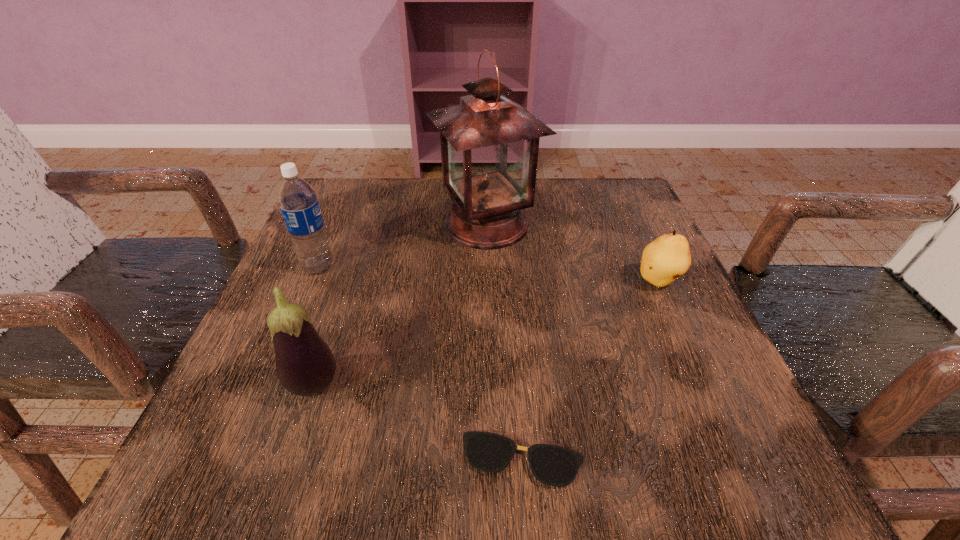
Image resolution: width=960 pixels, height=540 pixels. In order to click on the tallest object in this screenshot , I will do `click(489, 144)`.

Find the location of `water bottle`. water bottle is located at coordinates (298, 202).

Locate an element on the screen. This screenshot has width=960, height=540. eggplant is located at coordinates (305, 365).

At what (x,y) coordinates should I click in order to perform the action: click on the second nearest object. Please return your answer as a coordinate pair (x, y). Image resolution: width=960 pixels, height=540 pixels. Looking at the image, I should click on (305, 365).

Locate an element on the screen. The height and width of the screenshot is (540, 960). pear is located at coordinates (664, 260).

At what (x,y) coordinates should I click in order to perform the action: click on the second shortest object. Please return your answer as a coordinate pair (x, y). This screenshot has height=540, width=960. Looking at the image, I should click on (x=664, y=260).

I want to click on spectacles, so click(552, 465).

At what (x,y) coordinates should I click in order to perform the action: click on the shortest object. Please return your answer as a coordinate pair (x, y). The width and height of the screenshot is (960, 540). Looking at the image, I should click on (552, 465).

Locate an element on the screen. The width and height of the screenshot is (960, 540). vacant point located 0.190m on the front of the oil lamp is located at coordinates (489, 331).

At what (x,y) coordinates should I click in order to perform the action: click on vacant space located 0.330m on the right of the water bottle. Please return your answer as a coordinate pair (x, y). The height and width of the screenshot is (540, 960). Looking at the image, I should click on (503, 267).